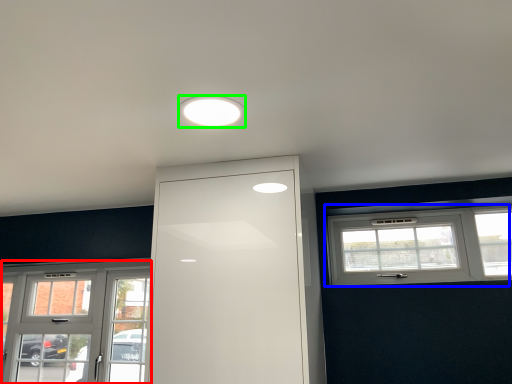
Question: Considering the real-world distances, which object is closest to window (highlighted by a red box)? window (highlighted by a blue box) or lighting (highlighted by a green box).

Choices:
 (A) window
 (B) lighting

Answer: (A)